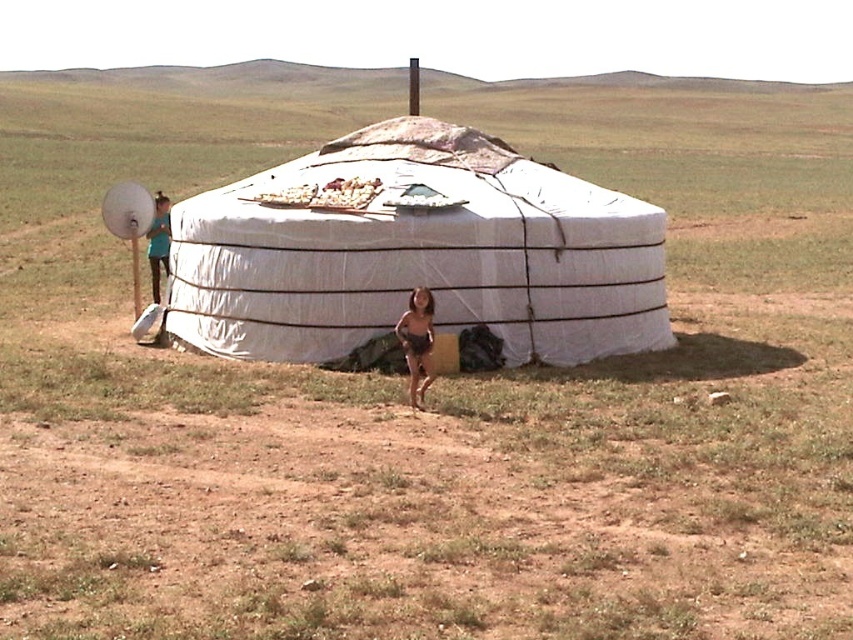
You are a traveler who just arrived at the yurt and need to choose clothing to stay warm. You see the brown fabric shorts at center and the teal fabric shirt at left. Which item is more suitable for warmth based on their sizes?

The teal fabric shirt at left is more suitable for warmth because it has a larger size compared to the brown fabric shorts at center.

You are a photographer standing in front of the yurt. You notice the brown fabric shorts at center and the white crumbly food at center in the scene. Which object is positioned more to the left?

The white crumbly food at center is positioned more to the left because the brown fabric shorts at center is to the right of it.